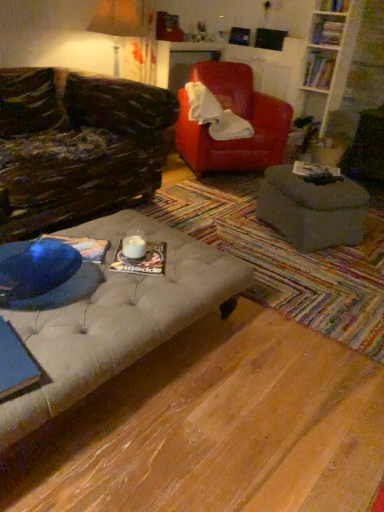
Question: Is blue paper at center, the fifth book when ordered from top to bottom, spatially inside tufted fabric ottoman at center, or outside of it?

Choices:
 (A) inside
 (B) outside

Answer: (B)

Question: From a real-world perspective, is blue paper at center, arranged as the fifth book when viewed from the back, positioned above or below tufted fabric ottoman at center?

Choices:
 (A) above
 (B) below

Answer: (A)

Question: Which object is positioned closest to the matte brown lampshade at upper left?

Choices:
 (A) tufted fabric ottoman at center
 (B) blue paper at center, marked as the second book in a front-to-back arrangement
 (C) hardcover book at upper right, which is the 3th book in back-to-front order
 (D) hardcover book at center, the 3th book ordered from the bottom
 (E) matte paper book at center, the sixth book from the top

Answer: (C)

Question: Estimate the real-world distances between objects in this image. Which object is farther from the hardcover book at upper right, the 6th book viewed from the front?

Choices:
 (A) matte red leather armchair at center
 (B) matte gray ottoman at center
 (C) matte paper book at center, which appears as the first book when viewed from the front
 (D) matte brown lampshade at upper left
 (E) tufted fabric ottoman at center

Answer: (C)